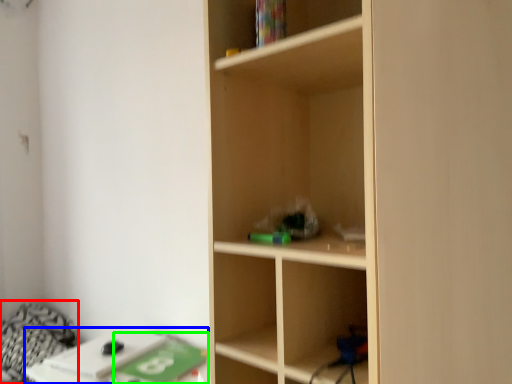
Question: Which object is positioned farthest from bedding (highlighted by a red box)? Select from table (highlighted by a blue box) and paperback book (highlighted by a green box).

Choices:
 (A) table
 (B) paperback book

Answer: (B)